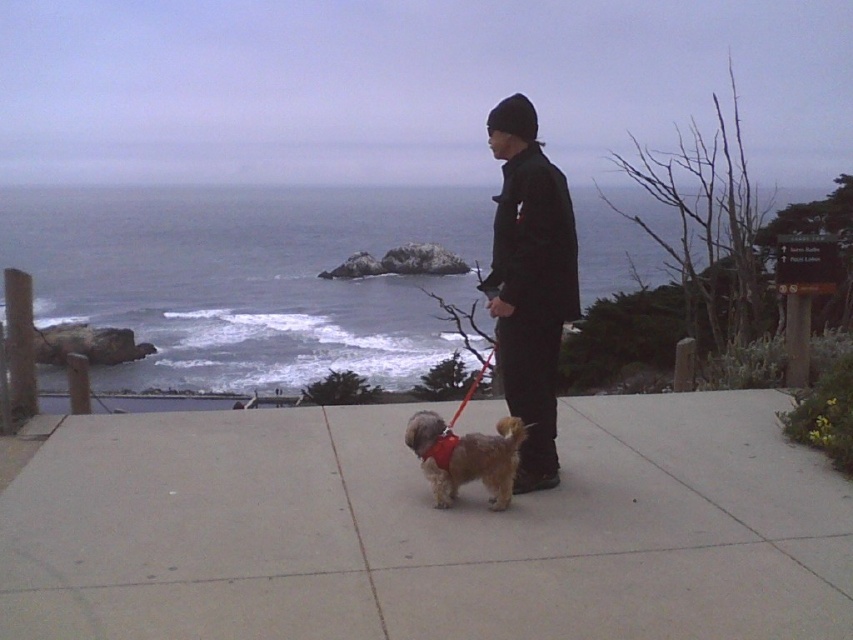
Question: Is black matte jacket at center to the left of fuzzy brown dog at center from the viewer's perspective?

Choices:
 (A) no
 (B) yes

Answer: (A)

Question: Which of the following is the closest to the observer?

Choices:
 (A) (422, 413)
 (B) (772, 595)

Answer: (B)

Question: Can you confirm if concrete sidewalk at center is thinner than black matte jacket at center?

Choices:
 (A) no
 (B) yes

Answer: (A)

Question: Which object is closer to the camera taking this photo?

Choices:
 (A) fuzzy brown dog at center
 (B) black matte jacket at center
 (C) concrete sidewalk at center

Answer: (C)

Question: Observing the image, what is the correct spatial positioning of concrete sidewalk at center in reference to fuzzy brown dog at center?

Choices:
 (A) right
 (B) left

Answer: (B)

Question: Among these points, which one is farthest from the camera?

Choices:
 (A) 419,436
 (B) 73,618

Answer: (A)